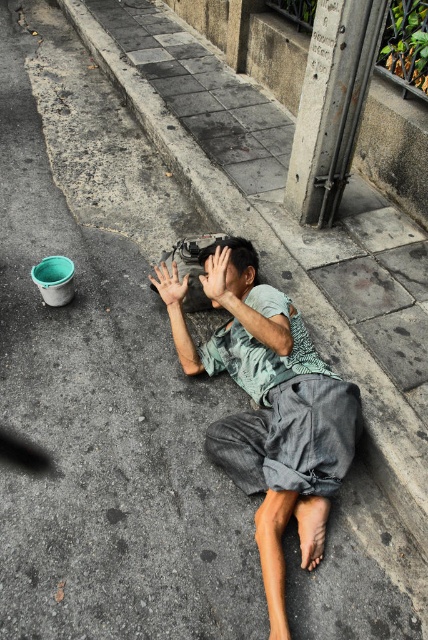
Question: Which object is the farthest from the gray cotton shirt at center?

Choices:
 (A) dark skin hand at center
 (B) smooth skin hand at center

Answer: (B)

Question: Which object is closer to the camera taking this photo?

Choices:
 (A) dark skin hand at center
 (B) smooth skin hand at center
 (C) gray cotton shirt at center

Answer: (C)

Question: Is gray cotton shirt at center above dark skin hand at center?

Choices:
 (A) yes
 (B) no

Answer: (B)

Question: In this image, where is gray cotton shirt at center located relative to smooth skin hand at center?

Choices:
 (A) below
 (B) above

Answer: (A)

Question: Which of these objects is positioned closest to the dark skin hand at center?

Choices:
 (A) gray cotton shirt at center
 (B) smooth skin hand at center

Answer: (B)

Question: Is gray cotton shirt at center to the right of smooth skin hand at center from the viewer's perspective?

Choices:
 (A) no
 (B) yes

Answer: (B)